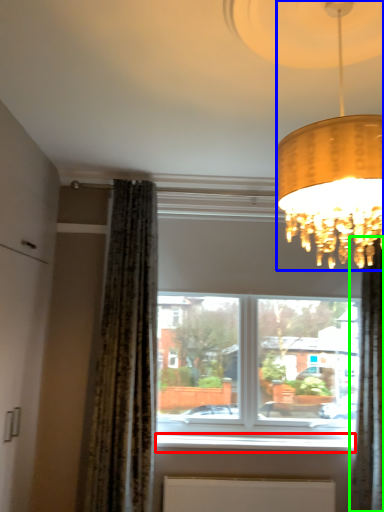
Question: Which object is positioned farthest from window sill (highlighted by a red box)? Select from lamp (highlighted by a blue box) and curtain (highlighted by a green box).

Choices:
 (A) lamp
 (B) curtain

Answer: (A)